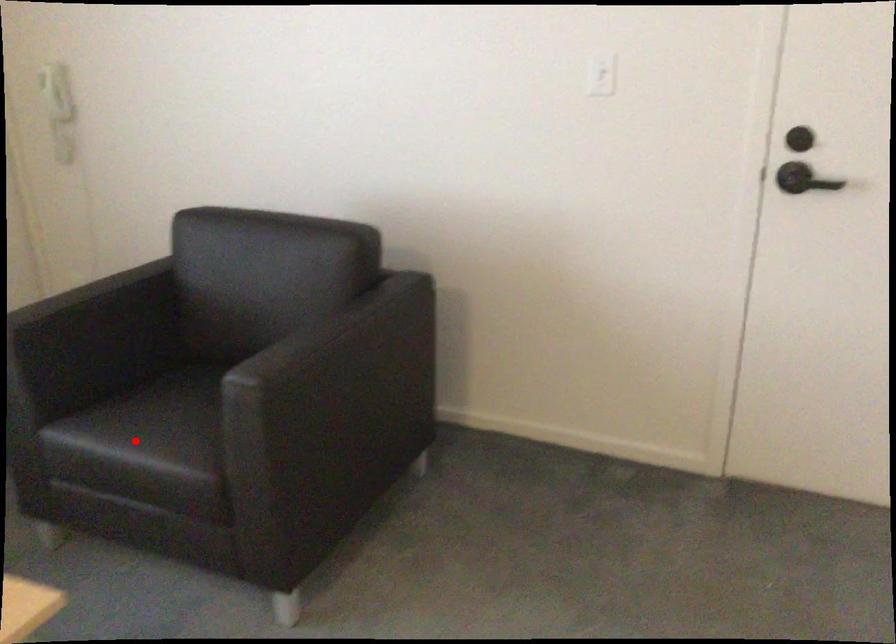
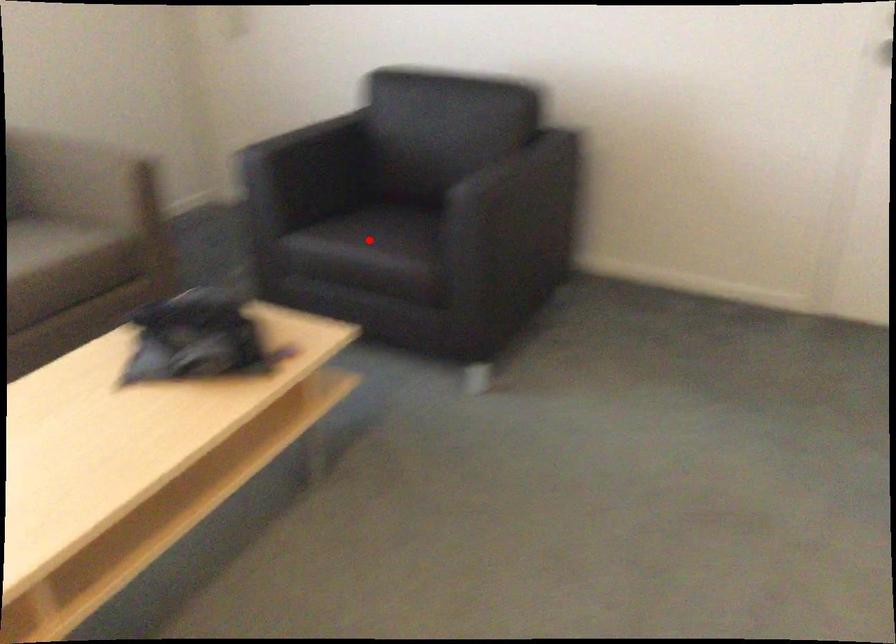
I am providing you with two images of the same scene from different viewpoints. A red point is marked on the first image and another point is marked on the second image. Are the points marked in image1 and image2 representing the same 3D position?

Yes